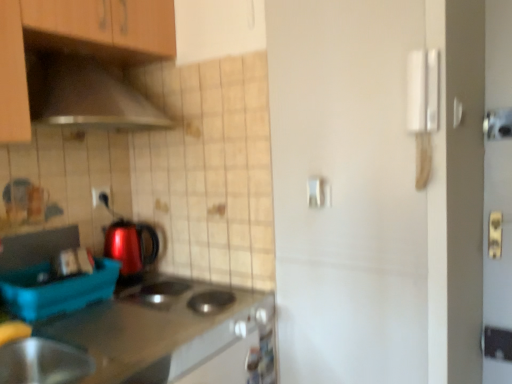
Image resolution: width=512 pixels, height=384 pixels. What do you see at coordinates (75, 42) in the screenshot?
I see `wooden cabinet at upper left` at bounding box center [75, 42].

What do you see at coordinates (100, 196) in the screenshot?
I see `matte black outlet at center` at bounding box center [100, 196].

What do you see at coordinates (318, 192) in the screenshot? This screenshot has width=512, height=384. I see `white matte door handle at center, the 2th door handle positioned from the right` at bounding box center [318, 192].

This screenshot has width=512, height=384. Identify the location of metallic stainless steel countertop at lower left. (162, 332).

Considering the positions of objects white plastic door handle at upper right, the first door handle in the front-to-back sequence, and blue plastic container at lower left in the image provided, who is in front, white plastic door handle at upper right, the first door handle in the front-to-back sequence, or blue plastic container at lower left?

white plastic door handle at upper right, the first door handle in the front-to-back sequence, is closer to the camera.

Between point (425, 73) and point (108, 264), which one is positioned in front?

Positioned in front is point (425, 73).

Measure the distance between white plastic door handle at upper right, the 2th door handle in the bottom-to-top sequence, and blue plastic container at lower left.

They are 1.18 meters apart.

How much distance is there between shiny plastic kettle at center-left and metallic stainless steel countertop at lower left?

11.53 inches.

Which is closer, (137, 239) or (186, 297)?

Point (137, 239) is farther from the camera than point (186, 297).

Does shiny plastic kettle at center-left appear on the right side of metallic stainless steel countertop at lower left?

No, shiny plastic kettle at center-left is not to the right of metallic stainless steel countertop at lower left.

Considering their positions, is shiny plastic kettle at center-left located in front of or behind metallic stainless steel countertop at lower left?

Visually, shiny plastic kettle at center-left is located behind metallic stainless steel countertop at lower left.

From the image's perspective, which one is positioned higher, blue plastic container at lower left or white matte door handle at center, the 2th door handle positioned from the front?

From the image's view, white matte door handle at center, the 2th door handle positioned from the front, is above.

From a real-world perspective, is blue plastic container at lower left above or below white matte door handle at center, the 2th door handle positioned from the right?

Clearly, from a real-world perspective, blue plastic container at lower left is below white matte door handle at center, the 2th door handle positioned from the right.

Does blue plastic container at lower left have a greater width compared to white matte door handle at center, which appears as the second door handle when viewed from the top?

Indeed, blue plastic container at lower left has a greater width compared to white matte door handle at center, which appears as the second door handle when viewed from the top.

Is blue plastic container at lower left at the left side of white matte door handle at center, the 1th door handle when ordered from left to right?

Yes.

Considering the sizes of objects wooden cabinet at upper left and white plastic door handle at upper right, the second door handle viewed from the left, in the image provided, who is wider, wooden cabinet at upper left or white plastic door handle at upper right, the second door handle viewed from the left,?

Wider between the two is wooden cabinet at upper left.

Choose the correct answer: Is wooden cabinet at upper left inside white plastic door handle at upper right, the first door handle in the front-to-back sequence, or outside it?

wooden cabinet at upper left is spatially situated outside white plastic door handle at upper right, the first door handle in the front-to-back sequence.

Is point (2, 97) positioned after point (408, 96)?

No.

Does wooden cabinet at upper left touch white plastic door handle at upper right, the 2th door handle in the bottom-to-top sequence?

No, wooden cabinet at upper left is not beside white plastic door handle at upper right, the 2th door handle in the bottom-to-top sequence.

Which is more to the right, metallic stainless steel countertop at lower left or shiny plastic kettle at center-left?

metallic stainless steel countertop at lower left is more to the right.

From the picture: Is metallic stainless steel countertop at lower left wider than shiny plastic kettle at center-left?

Indeed, metallic stainless steel countertop at lower left has a greater width compared to shiny plastic kettle at center-left.

Considering the positions of point (166, 375) and point (124, 246), is point (166, 375) closer or farther from the camera than point (124, 246)?

Clearly, point (166, 375) is more distant from the camera than point (124, 246).

Consider the image. Which object is wider, shiny plastic kettle at center-left or white matte door handle at center, the 1th door handle when ordered from left to right?

With larger width is shiny plastic kettle at center-left.

Is shiny plastic kettle at center-left not inside white matte door handle at center, the first door handle when ordered from back to front?

Yes, shiny plastic kettle at center-left is outside of white matte door handle at center, the first door handle when ordered from back to front.

This screenshot has width=512, height=384. I want to click on kitchen appliance that appears below the white matte door handle at center, the 2th door handle positioned from the front (from a real-world perspective), so click(131, 245).

Which is behind, point (140, 238) or point (310, 185)?

Positioned behind is point (140, 238).

Can you tell me how much white matte door handle at center, the 1th door handle when ordered from left to right, and matte black outlet at center differ in facing direction?

white matte door handle at center, the 1th door handle when ordered from left to right, and matte black outlet at center are facing 89.2 degrees away from each other.

Considering the sizes of white matte door handle at center, the 1th door handle when ordered from left to right, and matte black outlet at center in the image, is white matte door handle at center, the 1th door handle when ordered from left to right, wider or thinner than matte black outlet at center?

In the image, white matte door handle at center, the 1th door handle when ordered from left to right, appears to be wider than matte black outlet at center.

Between white matte door handle at center, the 2th door handle positioned from the right, and matte black outlet at center, which one appears on the left side from the viewer's perspective?

Positioned to the left is matte black outlet at center.

Where is `electric outlet that appears below the white matte door handle at center, the first door handle when ordered from back to front (from the image's perspective)`? This screenshot has height=384, width=512. electric outlet that appears below the white matte door handle at center, the first door handle when ordered from back to front (from the image's perspective) is located at coordinates click(x=100, y=196).

From a real-world perspective, starting from the blue plastic container at lower left, which door handle is the 2nd one vertically above it? Please provide its 2D coordinates.

[(423, 107)]

Locate an element on the screen. The height and width of the screenshot is (384, 512). countertop in front of the shiny plastic kettle at center-left is located at coordinates (162, 332).

Which object lies nearer to the anchor point wooden cabinet at upper left, metallic stainless steel countertop at lower left or white plastic door handle at upper right, which appears as the 1th door handle when viewed from the top?

metallic stainless steel countertop at lower left lies closer to wooden cabinet at upper left than the other object.

Based on their spatial positions, is wooden cabinet at upper left or matte black outlet at center closer to metallic stainless steel bowl at lower left?

matte black outlet at center is closer to metallic stainless steel bowl at lower left.

Which object lies further to the anchor point metallic stainless steel bowl at lower left, white plastic door handle at upper right, the 1th door handle positioned from the right, or metallic stainless steel countertop at lower left?

white plastic door handle at upper right, the 1th door handle positioned from the right, is positioned further to the anchor metallic stainless steel bowl at lower left.

Looking at the image, which one is located further to white matte door handle at center, the 2th door handle positioned from the right, blue plastic container at lower left or shiny plastic kettle at center-left?

blue plastic container at lower left is further to white matte door handle at center, the 2th door handle positioned from the right.

Based on their spatial positions, is matte black outlet at center or shiny plastic kettle at center-left further from white matte door handle at center, the 2th door handle positioned from the right?

matte black outlet at center.

Based on their spatial positions, is shiny plastic kettle at center-left or metallic stainless steel bowl at lower left closer to white plastic door handle at upper right, the first door handle in the front-to-back sequence?

Based on the image, shiny plastic kettle at center-left appears to be nearer to white plastic door handle at upper right, the first door handle in the front-to-back sequence.

When comparing their distances from metallic stainless steel bowl at lower left, does blue plastic container at lower left or white plastic door handle at upper right, the first door handle in the front-to-back sequence, seem further?

white plastic door handle at upper right, the first door handle in the front-to-back sequence, lies further to metallic stainless steel bowl at lower left than the other object.

Which object lies nearer to the anchor point metallic stainless steel bowl at lower left, matte black outlet at center or white matte door handle at center, the first door handle when ordered from back to front?

Based on the image, matte black outlet at center appears to be nearer to metallic stainless steel bowl at lower left.

Find the location of `home appliance between matte black outlet at center and white matte door handle at center, the 1th door handle when ordered from left to right, from left to right`. home appliance between matte black outlet at center and white matte door handle at center, the 1th door handle when ordered from left to right, from left to right is located at coordinates (42, 362).

Where is `cabinetry situated between blue plastic container at lower left and white plastic door handle at upper right, the first door handle in the front-to-back sequence, from left to right`? cabinetry situated between blue plastic container at lower left and white plastic door handle at upper right, the first door handle in the front-to-back sequence, from left to right is located at coordinates (75, 42).

You are a GUI agent. You are given a task and a screenshot of the screen. Output one action in this format:
    pyautogui.click(x=<x>, y=<y>)
    Task: Click on the home appliance between blue plastic container at lower left and white matte door handle at center, the first door handle when ordered from back to front, in the horizontal direction
    This screenshot has width=512, height=384.
    Given the screenshot: What is the action you would take?
    pyautogui.click(x=42, y=362)

Find the location of a particular element. The width and height of the screenshot is (512, 384). home appliance that lies between wooden cabinet at upper left and metallic stainless steel countertop at lower left from top to bottom is located at coordinates (42, 362).